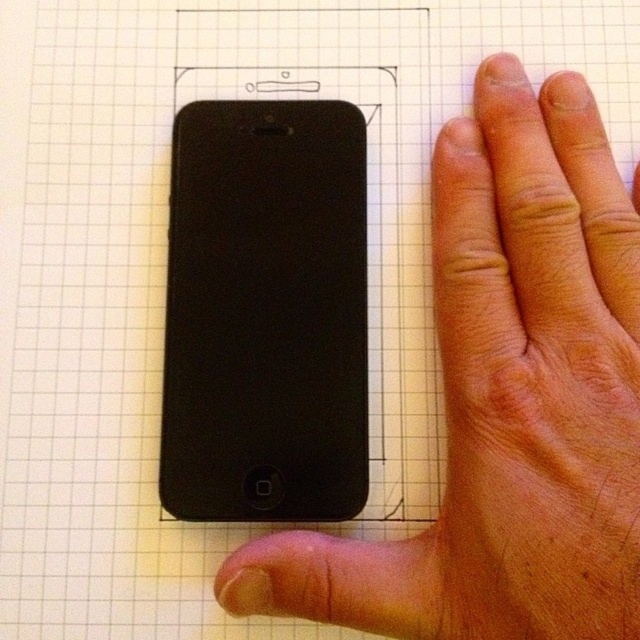
Based on the photo, can you confirm if matte black phone at left is shorter than matte black smartphone at center?

No.

Does point (314, 531) come closer to viewer compared to point (360, 113)?

Yes, it is in front of point (360, 113).

Measure the distance between point [451,584] and camera.

Point [451,584] and camera are 20.19 inches apart.

The width and height of the screenshot is (640, 640). What are the coordinates of `matte black phone at left` in the screenshot? It's located at (506, 397).